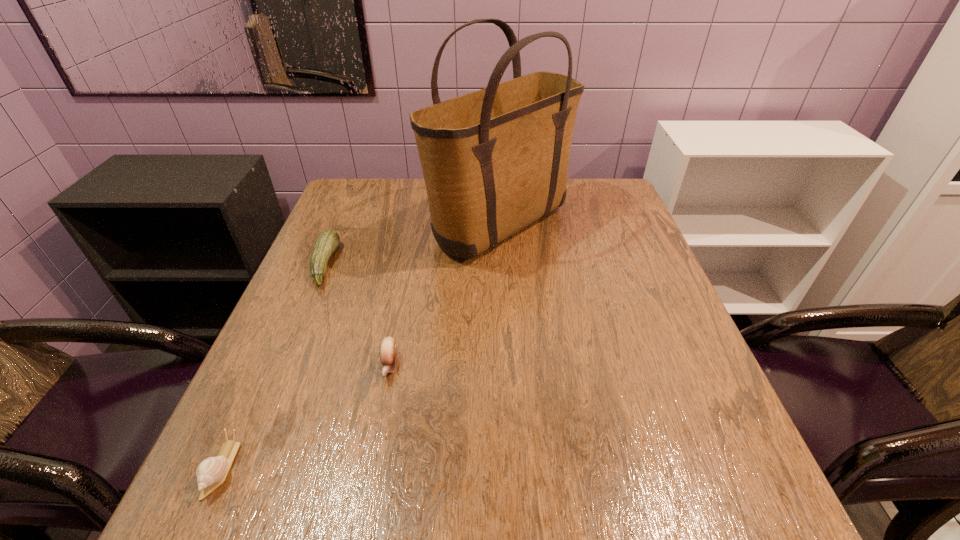
This screenshot has width=960, height=540. What are the coordinates of `object at the far edge` in the screenshot? It's located at (495, 160).

You are a GUI agent. You are given a task and a screenshot of the screen. Output one action in this format:
    pyautogui.click(x=<x>, y=<y>)
    Task: Click on the object at the near edge
    
    Given the screenshot: What is the action you would take?
    pyautogui.click(x=211, y=473)

Identify the location of zucchini situated at the left edge. The height and width of the screenshot is (540, 960). (328, 240).

Where is `escargot located at the left edge`? escargot located at the left edge is located at coordinates (211, 473).

This screenshot has height=540, width=960. What are the coordinates of `object present at the near left corner` in the screenshot? It's located at (211, 473).

This screenshot has height=540, width=960. In the image, there is a desktop. Identify the location of free space at the far edge. (403, 180).

Where is `free region at the near edge of the desktop`? free region at the near edge of the desktop is located at coordinates (540, 477).

This screenshot has width=960, height=540. Identify the location of free spot at the left edge of the desktop. (313, 302).

In the image, there is a desktop. At what (x,y) coordinates should I click in order to perform the action: click on vacant space at the right edge. Please return your answer as a coordinate pair (x, y). Looking at the image, I should click on (609, 253).

You are a GUI agent. You are given a task and a screenshot of the screen. Output one action in this format:
    pyautogui.click(x=<x>, y=<y>)
    Task: Click on the vacant space at the far left corner of the desktop
    Image resolution: width=960 pixels, height=540 pixels.
    Given the screenshot: What is the action you would take?
    pyautogui.click(x=357, y=196)